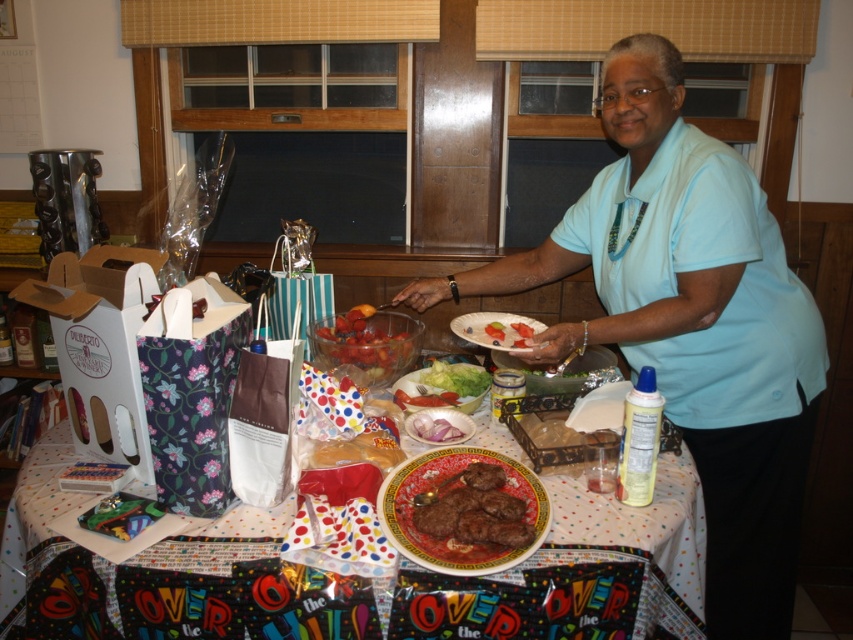
Does polka dot tablecloth at lower center have a greater width compared to shiny plastic bowl at center?

Yes.

Is polka dot tablecloth at lower center to the right of shiny plastic bowl at center from the viewer's perspective?

Correct, you'll find polka dot tablecloth at lower center to the right of shiny plastic bowl at center.

Is point (569, 476) positioned before point (337, 332)?

Yes, it is.

The image size is (853, 640). In order to click on polka dot tablecloth at lower center in this screenshot , I will do `click(639, 522)`.

Can you confirm if brown matte meatballs at center is wider than green leafy lettuce at center?

Yes, brown matte meatballs at center is wider than green leafy lettuce at center.

Is brown matte meatballs at center in front of green leafy lettuce at center?

That is True.

Locate an element on the screen. The image size is (853, 640). brown matte meatballs at center is located at coordinates tap(473, 516).

You are a GUI agent. You are given a task and a screenshot of the screen. Output one action in this format:
    pyautogui.click(x=<x>, y=<y>)
    Task: Click on the brown matte meatballs at center
    Image resolution: width=853 pixels, height=640 pixels.
    Given the screenshot: What is the action you would take?
    pyautogui.click(x=473, y=516)

In the scene shown: Does light blue shirt at center appear on the right side of white matte plate at center?

Correct, you'll find light blue shirt at center to the right of white matte plate at center.

Does light blue shirt at center appear under white matte plate at center?

Correct, light blue shirt at center is located below white matte plate at center.

I want to click on light blue shirt at center, so click(689, 323).

Image resolution: width=853 pixels, height=640 pixels. What are the coordinates of `light blue shirt at center` in the screenshot? It's located at (689, 323).